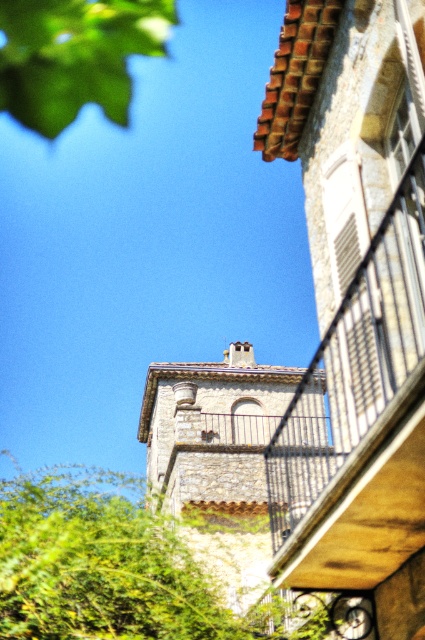
You are standing on the balcony of the stone building and want to take a photo of the green leafy tree at lower left. If the camera you are using has a maximum focus range of 25 meters, will it be able to capture the tree clearly?

The green leafy tree at lower left and camera are 24.95 meters apart from each other, which is within the camera maximum focus range of 25 meters. Therefore, the camera can capture the tree clearly.

You are standing on the balcony of the stone building and want to look at the two green leafy trees. Which tree is closer to you, the green leafy tree at lower left or the green leafy tree at upper left?

The green leafy tree at lower left is closer to the viewer than the green leafy tree at upper left.